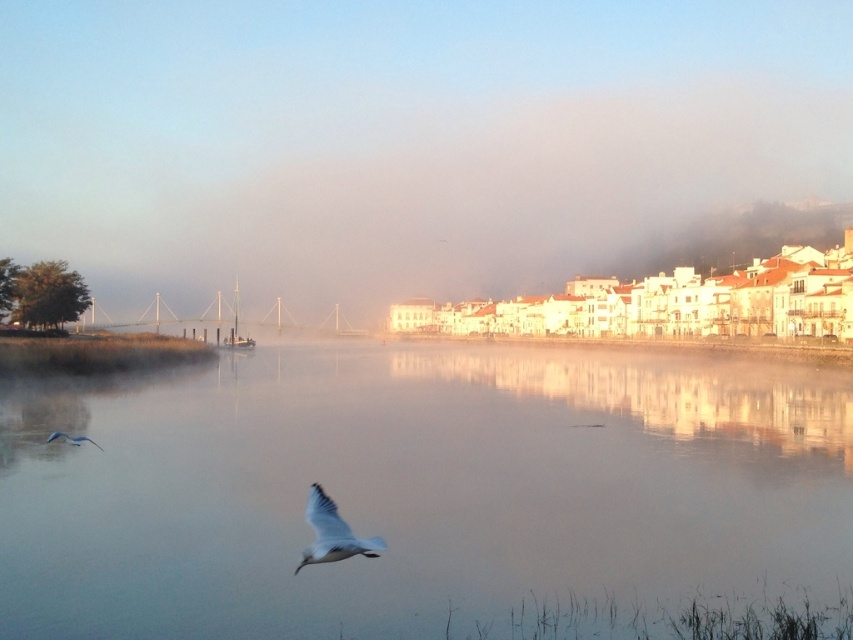
You are a photographer trying to capture the reflection of the sky in the clear water at center. However, you notice the white matte bird at lower left might block the view. Based on their sizes, will the bird obstruct the reflection of the sky in the water?

The clear water at center is wider than the white matte bird at lower left, so the bird is smaller in width. Therefore, the white matte bird at lower left won

You are standing on the riverside and see two points in the sky. The first point is labeled as point (473, 490) and the second is point (306, 547). Which point is closer to you?

Point (306, 547) is closer to you because it is in front of point (473, 490).

You are standing at the riverside and want to know how far the point at coordinates [289,294] is from your current position. Can you determine the distance?

The point at coordinates [289,294] is 322.61 meters away from your current position.